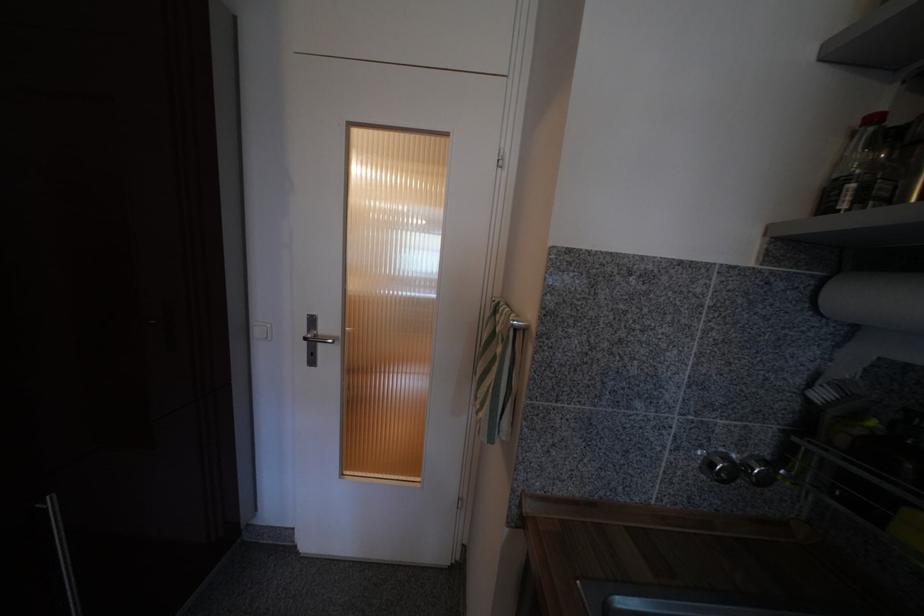
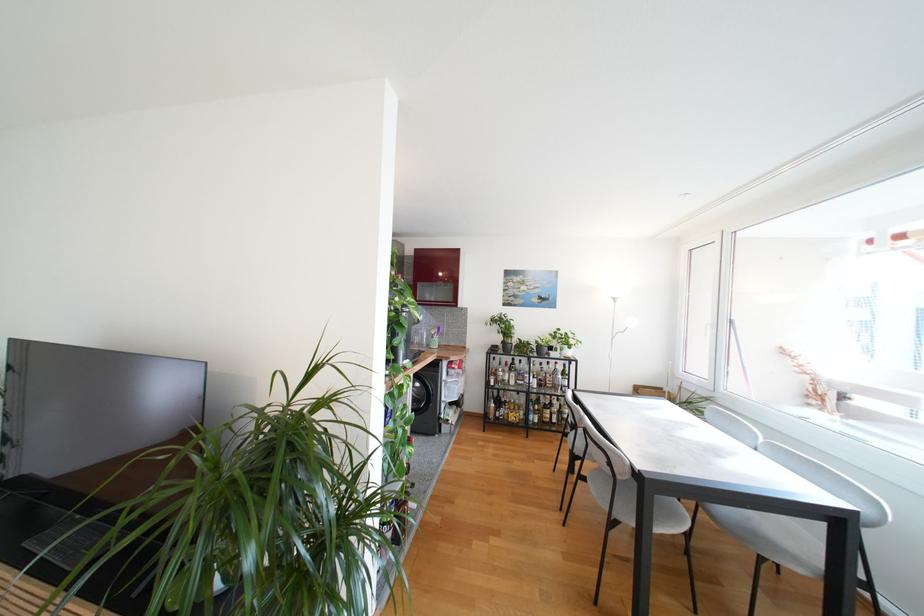
Question: I am providing you with two images of the same scene from different viewpoints. After the viewpoint changes to image2, which objects are now occluded?

Choices:
 (A) grey chair sitting surface
 (B) red bottle cap
 (C) utensil holder
 (D) small floral block

Answer: (B)